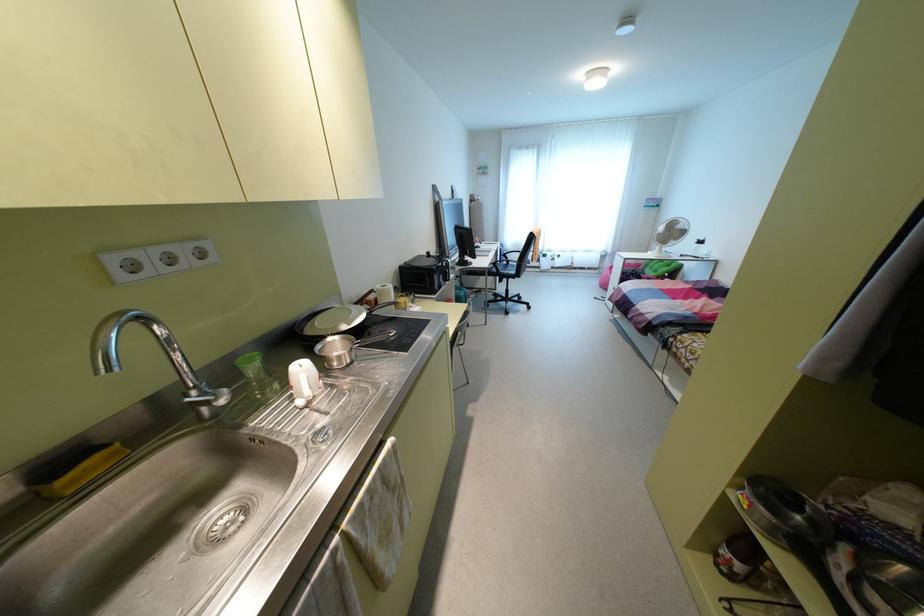
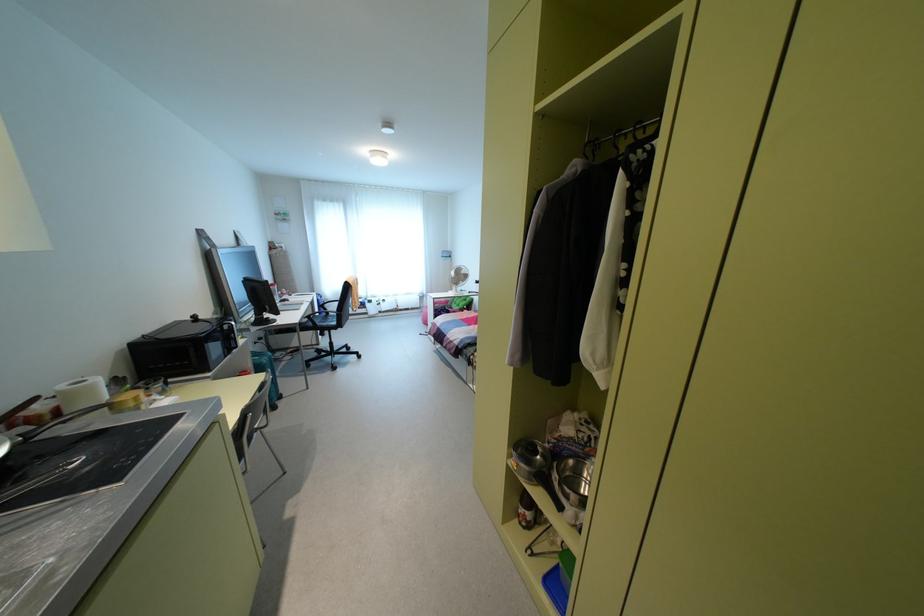
Where in the second image is the point corresponding to (x=493, y=262) from the first image?

(309, 315)